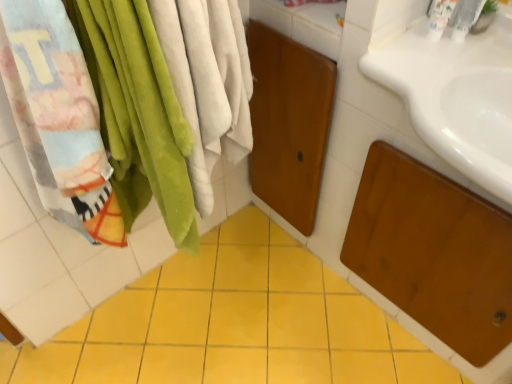
You are a GUI agent. You are given a task and a screenshot of the screen. Output one action in this format:
    pyautogui.click(x=<x>, y=<y>)
    Task: Click on the free space in front of white plastic faucet at upper right, placed as the 2th toiletry when sorted from left to right
    
    Given the screenshot: What is the action you would take?
    pyautogui.click(x=450, y=75)